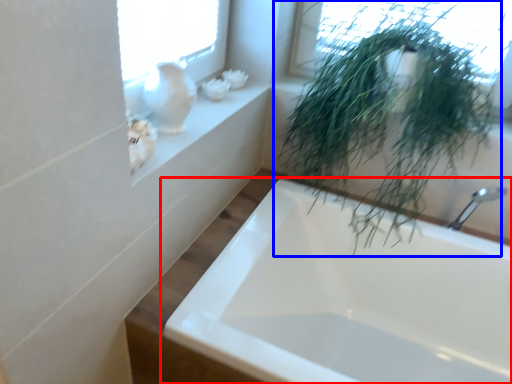
Question: Which of the following is the closest to the observer, bathtub (highlighted by a red box) or houseplant (highlighted by a blue box)?

Choices:
 (A) bathtub
 (B) houseplant

Answer: (A)